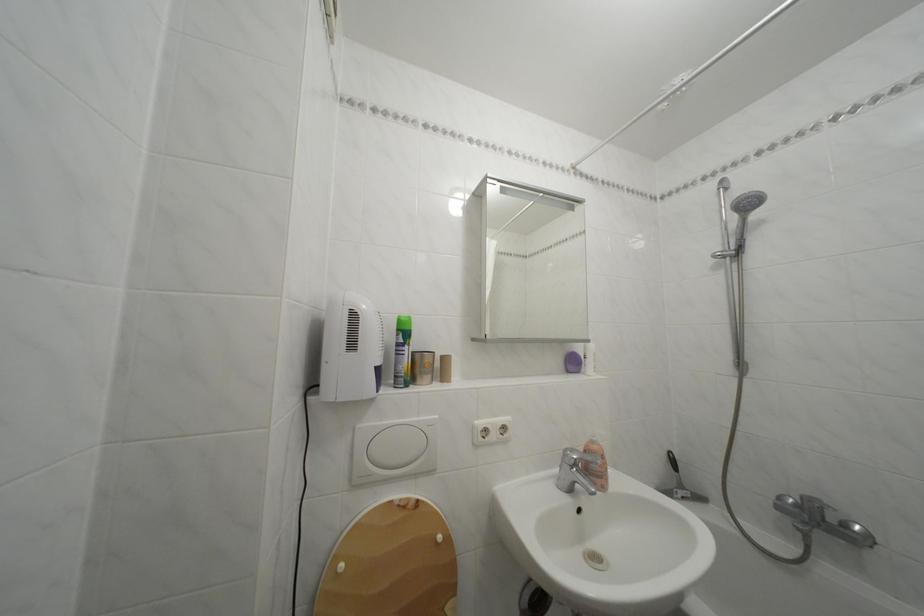
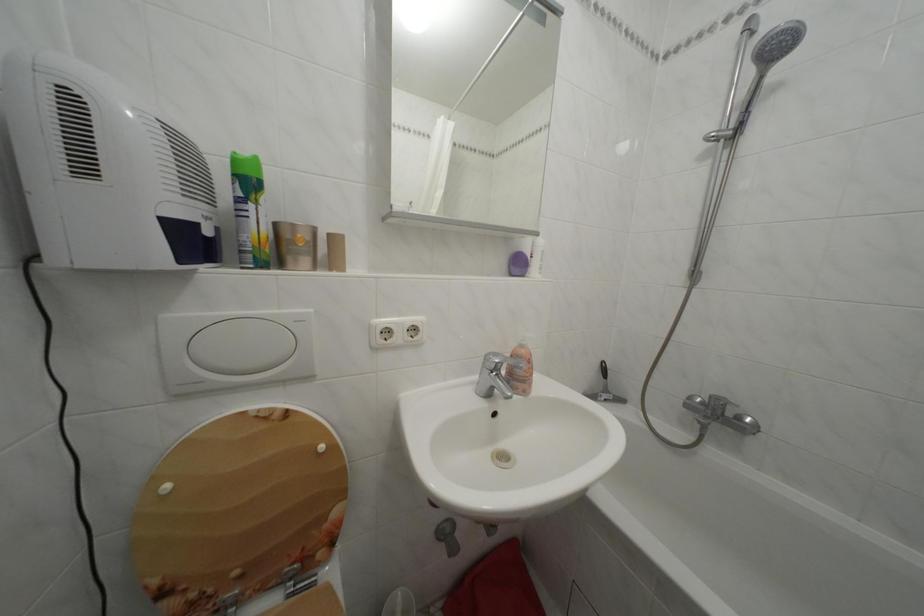
Where in the second image is the point corresponding to the point at 574,458 from the first image?

(495, 362)